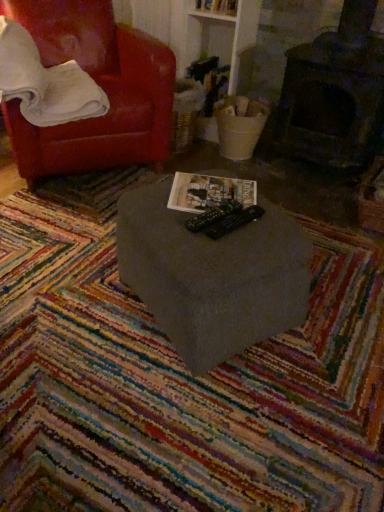
Question: Should I look upward or downward to see multicolored woven mat at center?

Choices:
 (A) up
 (B) down

Answer: (B)

Question: Is matte gray table at center located within white soft pillow at upper left?

Choices:
 (A) no
 (B) yes

Answer: (A)

Question: Could you tell me if white soft pillow at upper left is turned towards matte gray table at center?

Choices:
 (A) yes
 (B) no

Answer: (A)

Question: Does white soft pillow at upper left have a greater width compared to matte gray table at center?

Choices:
 (A) yes
 (B) no

Answer: (A)

Question: Is white soft pillow at upper left positioned with its back to matte gray table at center?

Choices:
 (A) no
 (B) yes

Answer: (A)

Question: From the image's perspective, is white soft pillow at upper left below matte gray table at center?

Choices:
 (A) yes
 (B) no

Answer: (B)

Question: Considering the relative positions of white soft pillow at upper left and matte gray table at center in the image provided, is white soft pillow at upper left to the left of matte gray table at center from the viewer's perspective?

Choices:
 (A) yes
 (B) no

Answer: (A)

Question: Is matte paper magazine at center directly adjacent to white soft pillow at upper left?

Choices:
 (A) yes
 (B) no

Answer: (B)

Question: Is matte paper magazine at center taller than white soft pillow at upper left?

Choices:
 (A) yes
 (B) no

Answer: (B)

Question: Does matte paper magazine at center have a larger size compared to white soft pillow at upper left?

Choices:
 (A) yes
 (B) no

Answer: (B)

Question: Is matte paper magazine at center shorter than white soft pillow at upper left?

Choices:
 (A) no
 (B) yes

Answer: (B)

Question: From a real-world perspective, is matte paper magazine at center on white soft pillow at upper left?

Choices:
 (A) no
 (B) yes

Answer: (A)

Question: Is matte paper magazine at center wider than white soft pillow at upper left?

Choices:
 (A) yes
 (B) no

Answer: (B)

Question: Is matte gray table at center facing away from multicolored woven mat at center?

Choices:
 (A) no
 (B) yes

Answer: (A)